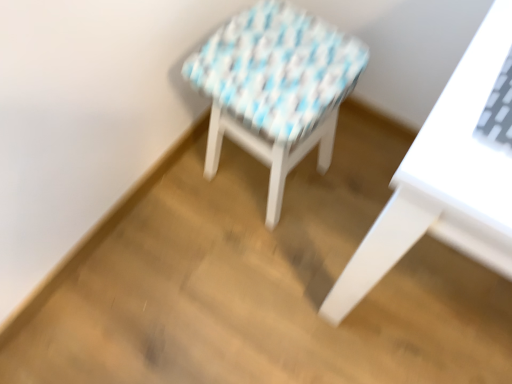
Identify the location of vacant space situated on the left part of white glossy table at right. The height and width of the screenshot is (384, 512). (260, 280).